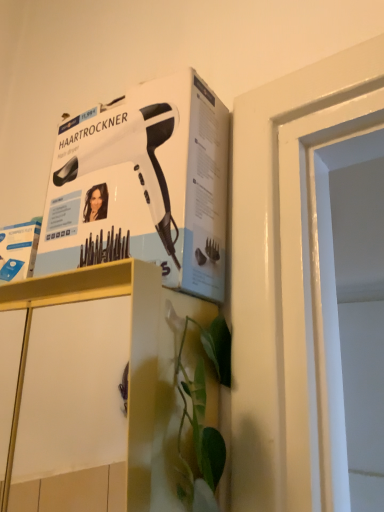
The image size is (384, 512). What do you see at coordinates (144, 185) in the screenshot?
I see `white matte hair dryer at upper left` at bounding box center [144, 185].

Find the location of a particular element. white matte hair dryer at upper left is located at coordinates (144, 185).

The image size is (384, 512). In order to click on matte gold cabinet at lower center in this screenshot , I will do `click(130, 343)`.

This screenshot has height=512, width=384. Describe the element at coordinates (130, 343) in the screenshot. I see `matte gold cabinet at lower center` at that location.

What is the approximate width of matte gold cabinet at lower center?

matte gold cabinet at lower center is 6.48 inches wide.

Find the location of a particular element. white matte hair dryer at upper left is located at coordinates (144, 185).

Would you say white matte hair dryer at upper left is to the left or to the right of matte gold cabinet at lower center in the picture?

white matte hair dryer at upper left is positioned on matte gold cabinet at lower center's right side.

Considering the relative positions of white matte hair dryer at upper left and matte gold cabinet at lower center in the image provided, is white matte hair dryer at upper left behind matte gold cabinet at lower center?

Yes, white matte hair dryer at upper left is further from the viewer.

Between point (72, 193) and point (128, 265), which one is positioned behind?

Point (72, 193)

From the image's perspective, is white matte hair dryer at upper left beneath matte gold cabinet at lower center?

No, from the image's perspective, white matte hair dryer at upper left is not below matte gold cabinet at lower center.

From a real-world perspective, which object rests below the other?

From a 3D spatial view, matte gold cabinet at lower center is below.

Between white matte hair dryer at upper left and matte gold cabinet at lower center, which one has smaller width?

Thinner between the two is white matte hair dryer at upper left.

Is white matte hair dryer at upper left shorter than matte gold cabinet at lower center?

Yes.

Based on their sizes in the image, would you say white matte hair dryer at upper left is bigger or smaller than matte gold cabinet at lower center?

white matte hair dryer at upper left is smaller than matte gold cabinet at lower center.

Is matte gold cabinet at lower center surrounded by white matte hair dryer at upper left?

No, matte gold cabinet at lower center is located outside of white matte hair dryer at upper left.

Is white matte hair dryer at upper left touching matte gold cabinet at lower center?

No, white matte hair dryer at upper left is not next to matte gold cabinet at lower center.

Based on the photo, could you tell me if white matte hair dryer at upper left is turned towards matte gold cabinet at lower center?

No, white matte hair dryer at upper left does not turn towards matte gold cabinet at lower center.

You are a GUI agent. You are given a task and a screenshot of the screen. Output one action in this format:
    pyautogui.click(x=<x>, y=<y>)
    Task: Click on the paperback book above the matte gold cabinet at lower center (from a real-world perspective)
    
    Given the screenshot: What is the action you would take?
    pyautogui.click(x=144, y=185)

Considering the relative positions of matte gold cabinet at lower center and white matte hair dryer at upper left in the image provided, is matte gold cabinet at lower center to the left of white matte hair dryer at upper left from the viewer's perspective?

Correct, you'll find matte gold cabinet at lower center to the left of white matte hair dryer at upper left.

Which object is further away from the camera, matte gold cabinet at lower center or white matte hair dryer at upper left?

white matte hair dryer at upper left is behind.

Which is closer, (2, 507) or (185, 124)?

Clearly, point (2, 507) is more distant from the camera than point (185, 124).

In the scene shown: From the image's perspective, which one is positioned higher, matte gold cabinet at lower center or white matte hair dryer at upper left?

white matte hair dryer at upper left is shown above in the image.

From a real-world perspective, is matte gold cabinet at lower center physically above white matte hair dryer at upper left?

Actually, matte gold cabinet at lower center is physically below white matte hair dryer at upper left in the real world.

Considering the relative sizes of matte gold cabinet at lower center and white matte hair dryer at upper left in the image provided, is matte gold cabinet at lower center thinner than white matte hair dryer at upper left?

Incorrect, the width of matte gold cabinet at lower center is not less than that of white matte hair dryer at upper left.

Between matte gold cabinet at lower center and white matte hair dryer at upper left, which one has less height?

white matte hair dryer at upper left.

Considering the sizes of matte gold cabinet at lower center and white matte hair dryer at upper left in the image, is matte gold cabinet at lower center bigger or smaller than white matte hair dryer at upper left?

matte gold cabinet at lower center is bigger than white matte hair dryer at upper left.

Is white matte hair dryer at upper left a part of matte gold cabinet at lower center?

No, white matte hair dryer at upper left is located outside of matte gold cabinet at lower center.

Is matte gold cabinet at lower center far from white matte hair dryer at upper left?

Actually, matte gold cabinet at lower center and white matte hair dryer at upper left are a little close together.

Is matte gold cabinet at lower center oriented away from white matte hair dryer at upper left?

No.

Based on the photo, how many degrees apart are the facing directions of matte gold cabinet at lower center and white matte hair dryer at upper left?

5.32 degrees.

In the image, there is a white matte hair dryer at upper left. Identify the location of cabinetry below it (from the image's perspective). The image size is (384, 512). (130, 343).

The image size is (384, 512). What are the coordinates of `cabinetry located below the white matte hair dryer at upper left (from the image's perspective)` in the screenshot? It's located at (130, 343).

Find the location of a particular element. cabinetry that appears on the left of white matte hair dryer at upper left is located at coordinates (130, 343).